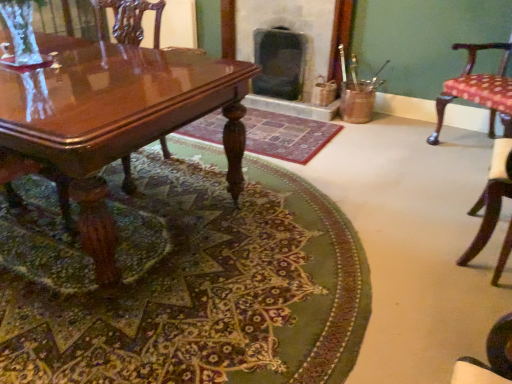
The width and height of the screenshot is (512, 384). What are the coordinates of `free point below polka dot fabric chair at right, which is counted as the 3th chair, starting from the left (from a real-world perspective)` in the screenshot? It's located at (468, 148).